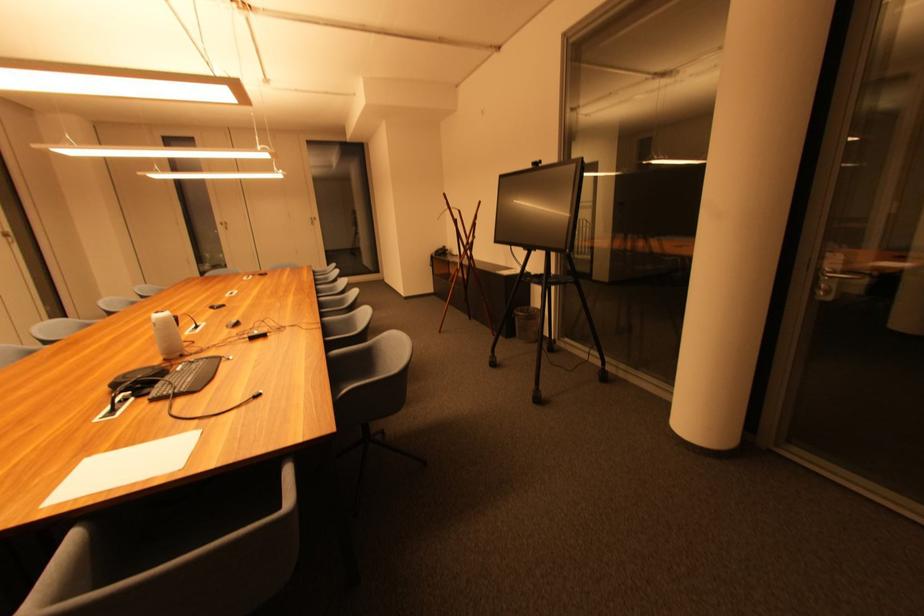
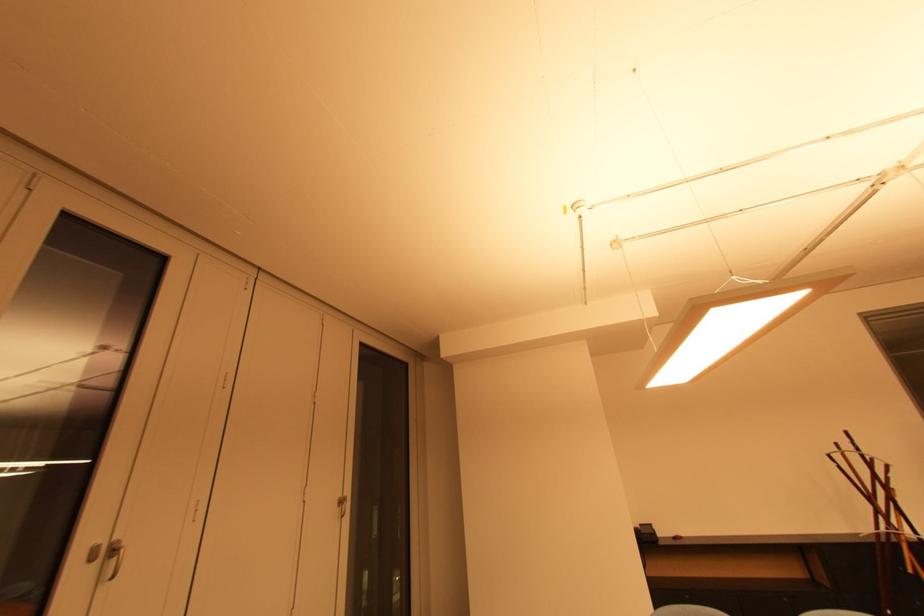
Where in the second image is the point corresponding to (x=319, y=222) from the first image?

(346, 504)